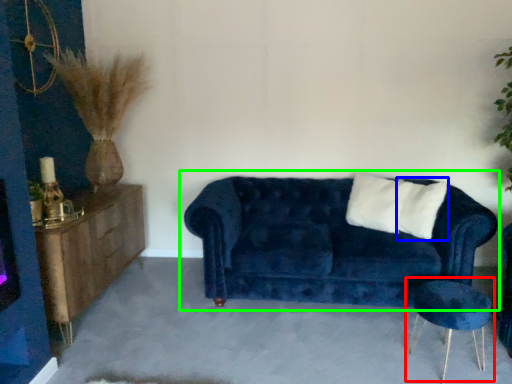
Question: Considering the real-world distances, which object is farthest from side table (highlighted by a red box)? pillow (highlighted by a blue box) or studio couch (highlighted by a green box)?

Choices:
 (A) pillow
 (B) studio couch

Answer: (A)